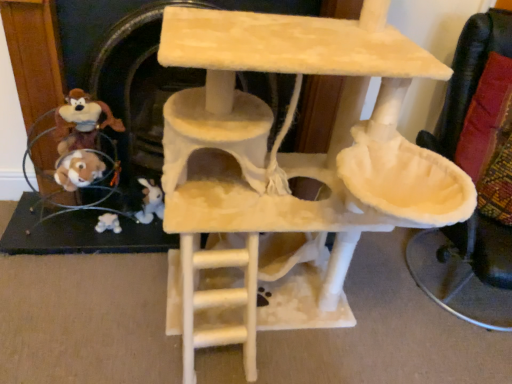
Identify the location of vacant space in beige felt cat tree at center (from a real-world perspective). (281, 324).